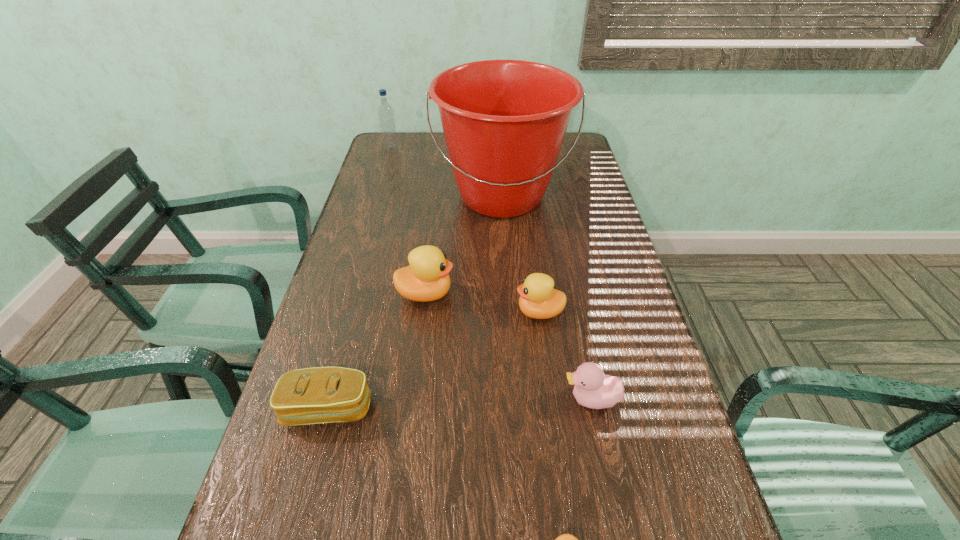
Identify the location of free spot located on the front of the second tallest object. The height and width of the screenshot is (540, 960). (375, 202).

Locate an element on the screen. The width and height of the screenshot is (960, 540). blank space located on the face of the biggest yellow duckling is located at coordinates (529, 293).

At what (x,y) coordinates should I click in order to perform the action: click on blank space located 0.240m on the face of the second biggest yellow duckling. Please return your answer as a coordinate pair (x, y). Looking at the image, I should click on (418, 312).

At what (x,y) coordinates should I click in order to perform the action: click on free location located on the face of the second biggest yellow duckling. Please return your answer as a coordinate pair (x, y). Looking at the image, I should click on (459, 312).

At what (x,y) coordinates should I click in order to perform the action: click on vacant space located on the face of the second biggest yellow duckling. Please return your answer as a coordinate pair (x, y). This screenshot has width=960, height=540. Looking at the image, I should click on (361, 312).

Where is `vacant region located on the front-facing side of the third farthest duckling`? The image size is (960, 540). vacant region located on the front-facing side of the third farthest duckling is located at coordinates (466, 399).

Where is `vacant space located 0.070m on the front-facing side of the third farthest duckling`? The image size is (960, 540). vacant space located 0.070m on the front-facing side of the third farthest duckling is located at coordinates (529, 399).

Where is `free space located on the front-facing side of the third farthest duckling`? The width and height of the screenshot is (960, 540). free space located on the front-facing side of the third farthest duckling is located at coordinates (466, 399).

The height and width of the screenshot is (540, 960). I want to click on vacant space located on the zipper side of the clutch bag, so click(x=307, y=485).

Find the location of a particular element. bucket positioned at the far edge is located at coordinates click(x=504, y=121).